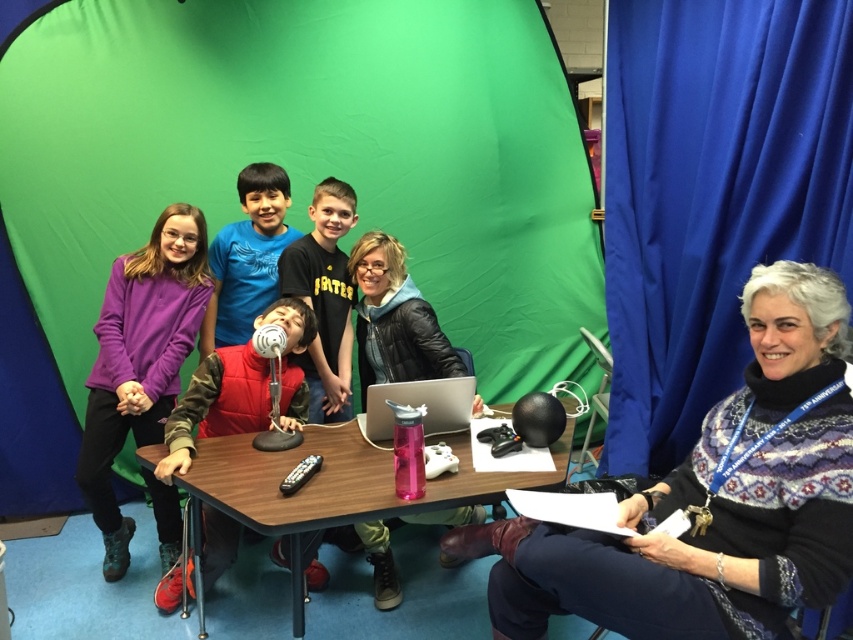
Question: Observing the image, what is the correct spatial positioning of green fabric tent at center in reference to wooden table at center?

Choices:
 (A) left
 (B) right

Answer: (A)

Question: Can you confirm if purple fleece sweater at left is positioned above velvet red vest at center?

Choices:
 (A) yes
 (B) no

Answer: (A)

Question: Is white wool sweater at right above purple fleece sweater at left?

Choices:
 (A) no
 (B) yes

Answer: (A)

Question: Which of the following is the farthest from the observer?

Choices:
 (A) silver metallic laptop at center
 (B) wooden table at center

Answer: (A)

Question: Which object is the closest to the white wool sweater at right?

Choices:
 (A) silver metallic laptop at center
 (B) wooden table at center

Answer: (B)

Question: Which object is the farthest from the green fabric tent at center?

Choices:
 (A) silver metallic laptop at center
 (B) velvet red vest at center
 (C) white wool sweater at right
 (D) wooden table at center

Answer: (C)